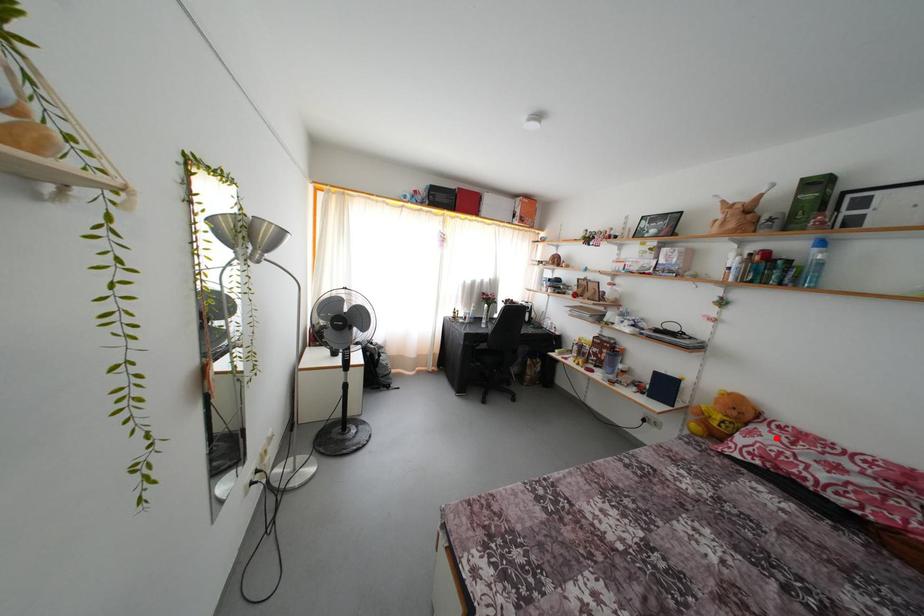
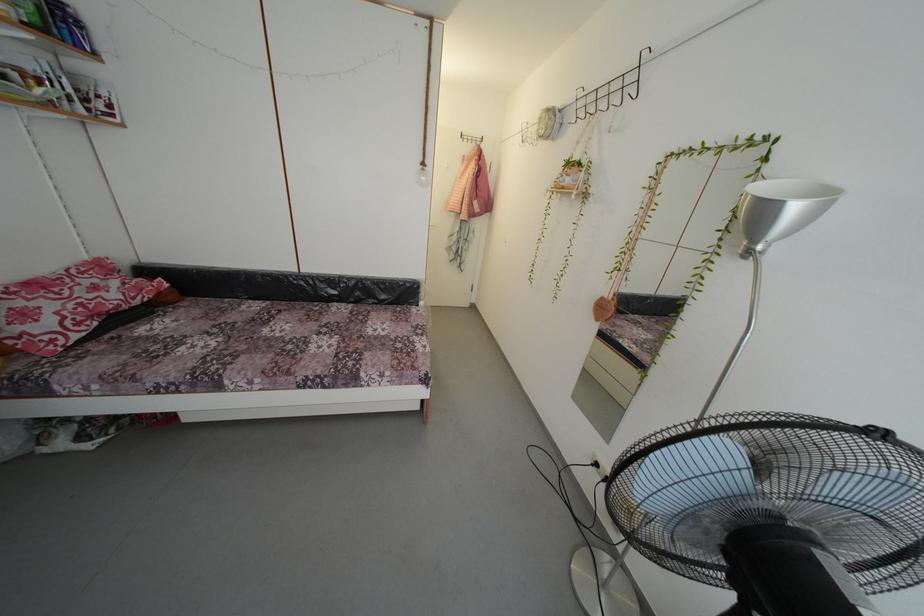
Locate, in the second image, the point that corresponds to the highlighted location in the first image.

(34, 306)